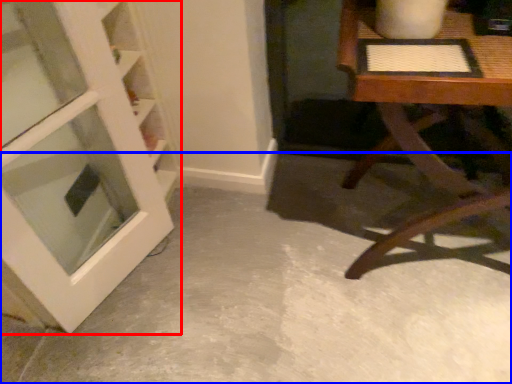
Question: Which of the following is the farthest to the observer, door (highlighted by a red box) or concrete (highlighted by a blue box)?

Choices:
 (A) door
 (B) concrete

Answer: (B)